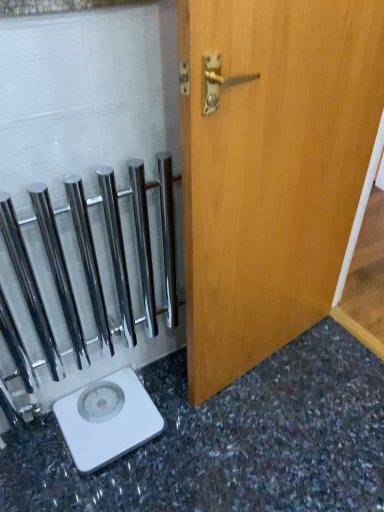
Question: In terms of width, does white plastic scale at lower left look wider or thinner when compared to light brown wood door at center?

Choices:
 (A) thin
 (B) wide

Answer: (B)

Question: In terms of size, does white plastic scale at lower left appear bigger or smaller than light brown wood door at center?

Choices:
 (A) small
 (B) big

Answer: (A)

Question: Which object is the closest to the granite gray surface at lower left?

Choices:
 (A) polished chrome towel bars at left
 (B) light brown wood door at center
 (C) white plastic scale at lower left

Answer: (C)

Question: Considering the real-world distances, which object is closest to the granite gray surface at lower left?

Choices:
 (A) light brown wood door at center
 (B) polished chrome towel bars at left
 (C) white plastic scale at lower left

Answer: (C)